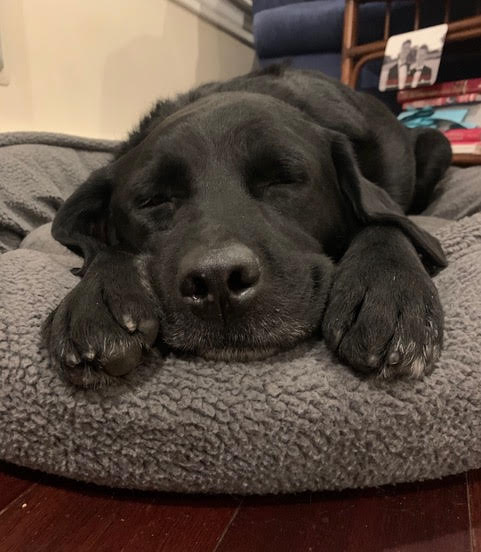
Where is `floor`? floor is located at coordinates (73, 514).